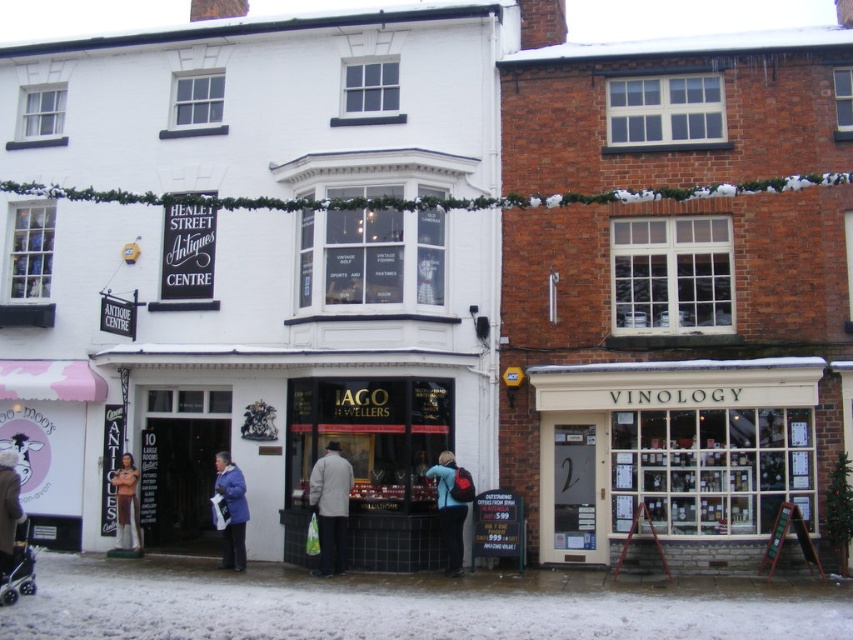
Question: Which object appears farthest from the camera in this image?

Choices:
 (A) white wooden storefront at lower right
 (B) dark blue coat at lower left
 (C) light gray fabric coat at center

Answer: (C)

Question: Is white wooden storefront at lower right closer to camera compared to light gray fabric coat at center?

Choices:
 (A) no
 (B) yes

Answer: (B)

Question: Which of the following is the closest to the observer?

Choices:
 (A) white snow at ground center
 (B) light gray fabric coat at center
 (C) matte black jewelry at center
 (D) blue down jacket at center

Answer: (A)

Question: Does matte black jewelry at center have a smaller size compared to blue down jacket at center?

Choices:
 (A) no
 (B) yes

Answer: (A)

Question: Which of the following is the farthest from the observer?

Choices:
 (A) (447, 477)
 (B) (331, 484)
 (C) (7, 474)
 (D) (403, 467)

Answer: (D)

Question: Can you confirm if white snow at ground center is positioned below blue down jacket at center?

Choices:
 (A) yes
 (B) no

Answer: (A)